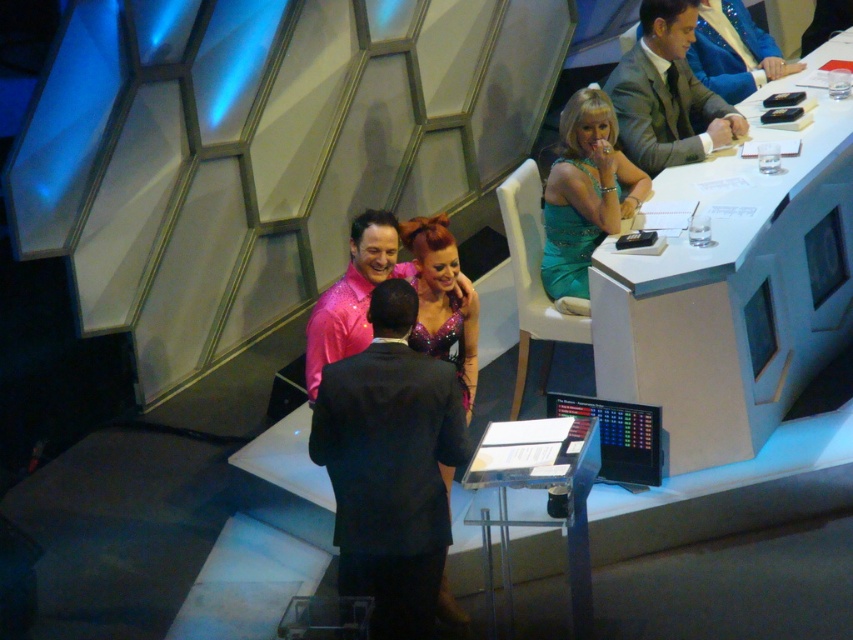
You are standing in the room and want to walk to the sparkly purple dress at center. There is a white plastic table at upper right in your way. Will you need to go around it?

The white plastic table at upper right is further to the viewer than the sparkly purple dress at center, so you are already in front of the table and can walk directly towards the dress without needing to go around it.

You are a photographer standing at the back of the room. You need to capture a photo of the white plastic table at upper right and the matte gray suit at upper right in the same frame. Considering the distance between them, will you be able to fit both into your camera viewfinder without moving closer or further away?

The white plastic table at upper right and the matte gray suit at upper right are 24.61 inches apart. Since the distance between them is relatively small, you should be able to fit both into your camera viewfinder without needing to adjust your position.

You are standing at the center of the room and want to place a new decorative item on the white plastic table at upper right. Based on its position, in which general direction should you move to reach it?

The white plastic table at upper right is located at point 0.459 on the x and 0.860 on the y axis. Since you are at the center, moving towards the upper right direction will get you to the table.